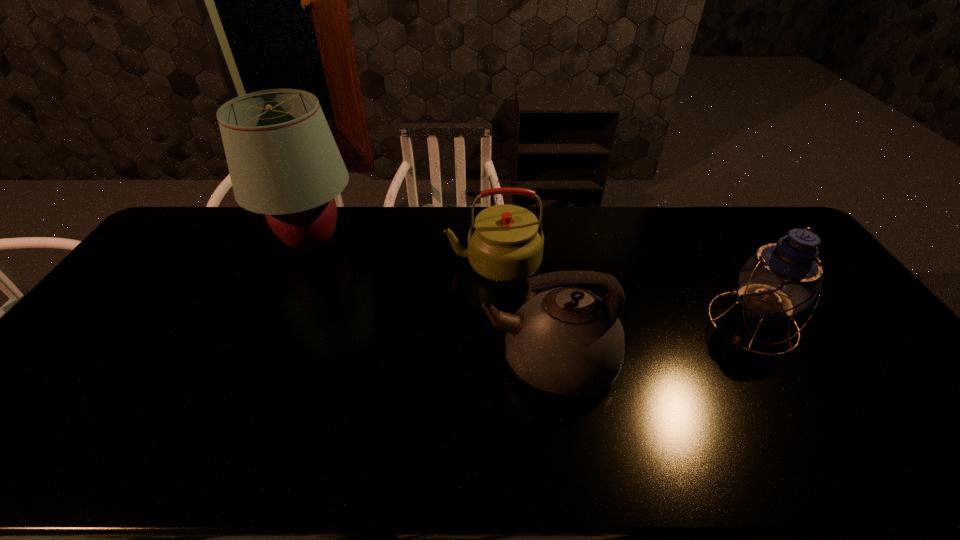
Image resolution: width=960 pixels, height=540 pixels. I want to click on the tallest object, so click(283, 161).

At what (x,y) coordinates should I click in order to perform the action: click on lantern. Please return your answer as a coordinate pair (x, y). This screenshot has height=540, width=960. Looking at the image, I should click on (782, 279).

Locate an element on the screen. The width and height of the screenshot is (960, 540). the nearer kettle is located at coordinates (567, 341).

Image resolution: width=960 pixels, height=540 pixels. I want to click on the farther kettle, so click(x=505, y=244).

Find the location of a particular element. shears is located at coordinates (178, 415).

This screenshot has height=540, width=960. Find the location of `blank area located on the front of the lampshade`. blank area located on the front of the lampshade is located at coordinates (274, 329).

The width and height of the screenshot is (960, 540). Identify the location of free spot located 0.060m on the front-facing side of the lantern. (784, 375).

Locate an element on the screen. This screenshot has width=960, height=540. free spot located 0.370m at the spout of the nearer kettle is located at coordinates (340, 362).

Where is `vacant space located 0.340m at the spout of the nearer kettle`? The image size is (960, 540). vacant space located 0.340m at the spout of the nearer kettle is located at coordinates (351, 362).

The width and height of the screenshot is (960, 540). Identify the location of vacant space located 0.180m at the spout of the nearer kettle. (413, 362).